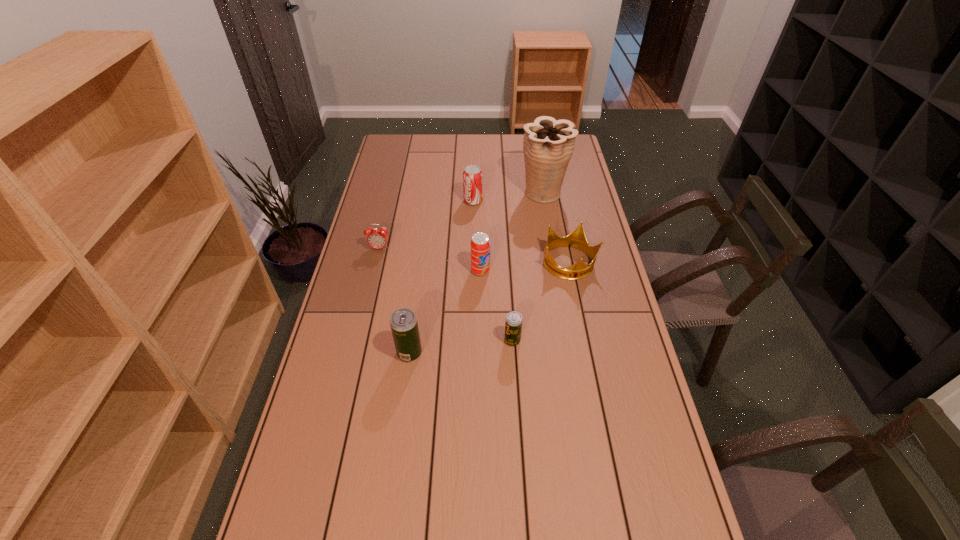
This screenshot has height=540, width=960. I want to click on vacant space at the near edge of the desktop, so click(x=465, y=496).

Where is `vacant space at the left edge of the desktop`? vacant space at the left edge of the desktop is located at coordinates tap(382, 256).

Where is `free space at the right edge`? Image resolution: width=960 pixels, height=540 pixels. free space at the right edge is located at coordinates (609, 310).

At what (x,y) coordinates should I click in order to perform the action: click on vacant area at the near left corner of the desktop. Please return your answer as a coordinate pair (x, y). The image size is (960, 540). Looking at the image, I should click on (315, 518).

The height and width of the screenshot is (540, 960). What are the coordinates of `free space at the near right corner` in the screenshot? It's located at (617, 502).

What are the coordinates of `free space between the crown and the taller beer can` in the screenshot? It's located at (490, 308).

What are the coordinates of `free point between the nearer soda can and the crown` in the screenshot? It's located at (525, 267).

The height and width of the screenshot is (540, 960). I want to click on vacant area that lies between the nearer soda can and the third object from right to left, so click(x=496, y=306).

Identify the location of free space that is in between the shorter beer can and the nearer soda can. 496,306.

The image size is (960, 540). I want to click on unoccupied area between the urn and the crown, so click(x=557, y=228).